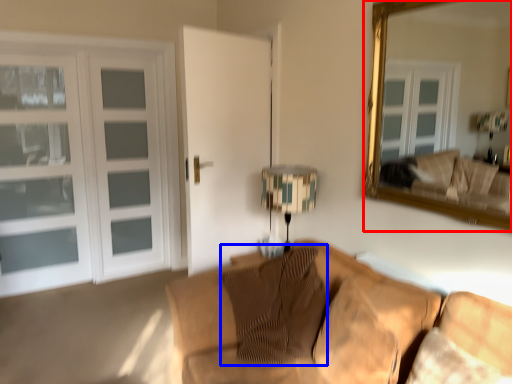
Question: Among these objects, which one is farthest to the camera, mirror (highlighted by a red box) or pillow (highlighted by a blue box)?

Choices:
 (A) mirror
 (B) pillow

Answer: (B)